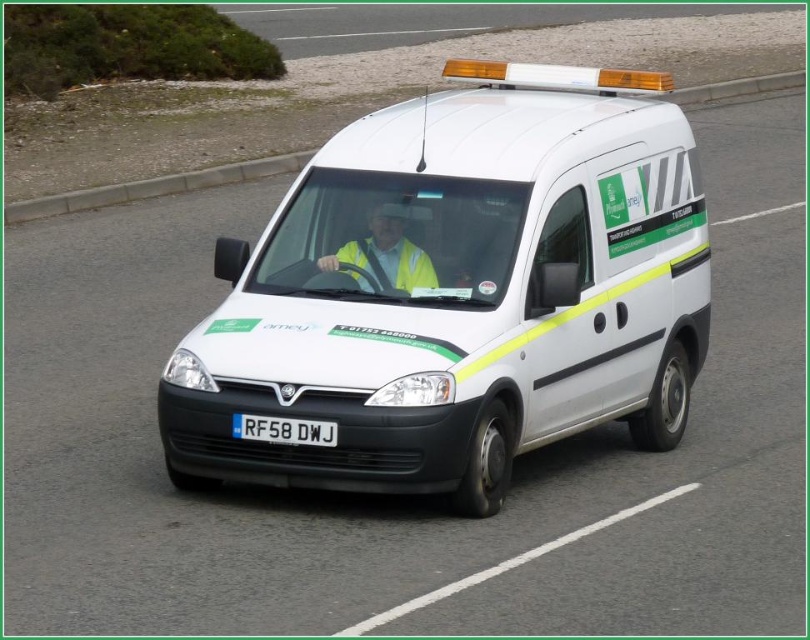
In the scene shown: You are standing on the side of the road and see the white van with the green stripe. There are two points marked on the van. Which point, point 1 at coordinates [429,157] or point 2 at [357,246], is closer to you?

Point 1 at coordinates [429,157] is closer to you because it is further to the viewer than point 2 at [357,246].

You are a pedestrian standing on the sidewalk. You see the white matte van at center and the yellow reflective vest at center. Which object is taller?

The white matte van at center is much taller than the yellow reflective vest at center.

You are a delivery driver who needs to park your white matte van at center in a parking spot that is exactly the width of the yellow reflective vest at center. Can your van fit into the parking spot without overlapping the lines?

The white matte van at center is wider than the yellow reflective vest at center, so it cannot fit into a parking spot that matches the vest width without overlapping the lines.